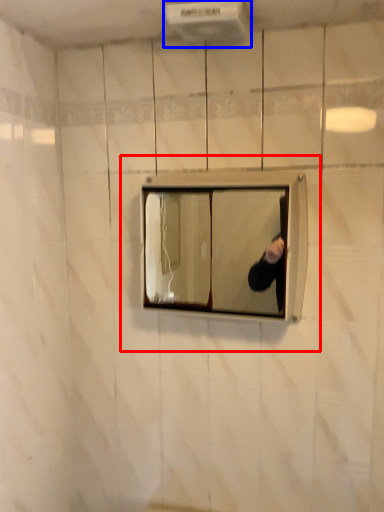
Question: Which object is closer to the camera taking this photo, medicine cabinet (highlighted by a red box) or air conditioner (highlighted by a blue box)?

Choices:
 (A) medicine cabinet
 (B) air conditioner

Answer: (B)